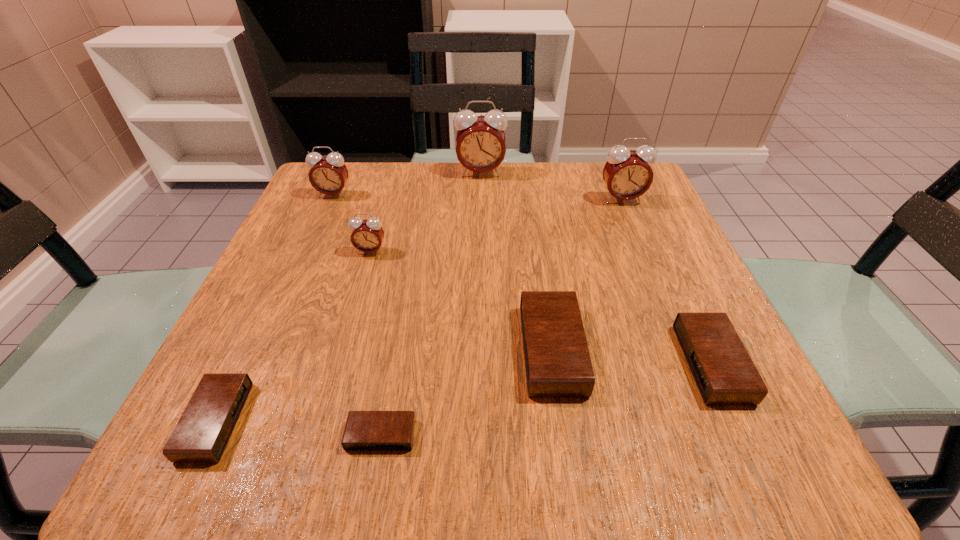
Identify the location of alarm clock identified as the fourth closest to the third biggest pink alarm clock. pyautogui.click(x=557, y=361).

Select which alarm clock is the fifth closest to the fourth tallest object. Please provide its 2D coordinates. Your answer should be formatted as a tuple, i.e. [(x, y)], where the tuple contains the x and y coordinates of a point satisfying the conditions above.

[(365, 430)]

Choose which pink alarm clock is the third nearest neighbor to the leftmost pink alarm clock. Please provide its 2D coordinates. Your answer should be formatted as a tuple, i.e. [(x, y)], where the tuple contains the x and y coordinates of a point satisfying the conditions above.

[(627, 174)]

Where is `the closest pink alarm clock relative to the rightmost pink alarm clock`? The image size is (960, 540). the closest pink alarm clock relative to the rightmost pink alarm clock is located at coordinates (480, 147).

In order to click on black alarm clock object that ranks as the fourth closest to the sixth shortest alarm clock in this screenshot , I will do `click(725, 374)`.

Where is `the third closest black alarm clock to the leftmost pink alarm clock`? the third closest black alarm clock to the leftmost pink alarm clock is located at coordinates (365, 430).

In order to click on free space that satisfies the following two spatial constraints: 1. on the front face of the third black alarm clock from left to right; 2. on the front face of the shortest alarm clock in this screenshot , I will do `click(564, 435)`.